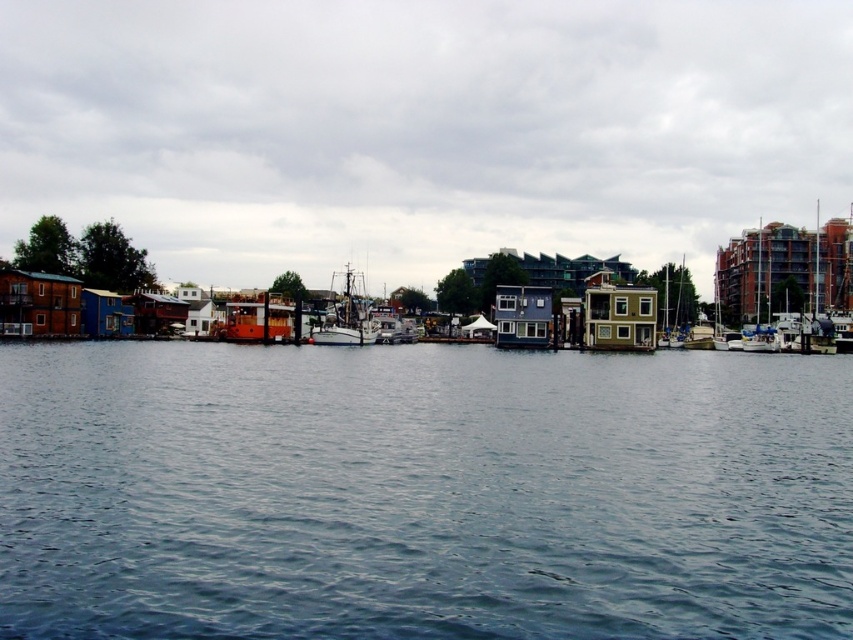
Question: Can you confirm if wooden ship at center is positioned below brick red building at right?

Choices:
 (A) no
 (B) yes

Answer: (B)

Question: From the image, what is the correct spatial relationship of blue water at center in relation to brick red building at right?

Choices:
 (A) right
 (B) left

Answer: (B)

Question: Which object is positioned closest to the brick red building at right?

Choices:
 (A) wooden cabin boat at center
 (B) wooden ship at center

Answer: (A)

Question: Estimate the real-world distances between objects in this image. Which object is closer to the wooden cabin boat at center?

Choices:
 (A) brick red building at right
 (B) blue water at center
 (C) wooden ship at center

Answer: (C)

Question: Which object appears closest to the camera in this image?

Choices:
 (A) wooden ship at center
 (B) brick red building at right
 (C) wooden cabin boat at center
 (D) blue water at center

Answer: (D)

Question: Is wooden ship at center further to camera compared to brick red building at right?

Choices:
 (A) yes
 (B) no

Answer: (B)